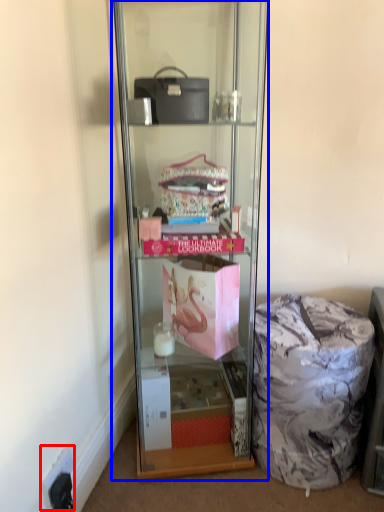
Question: Which object is further to the camera taking this photo, electric outlet (highlighted by a red box) or shelf (highlighted by a blue box)?

Choices:
 (A) electric outlet
 (B) shelf

Answer: (A)